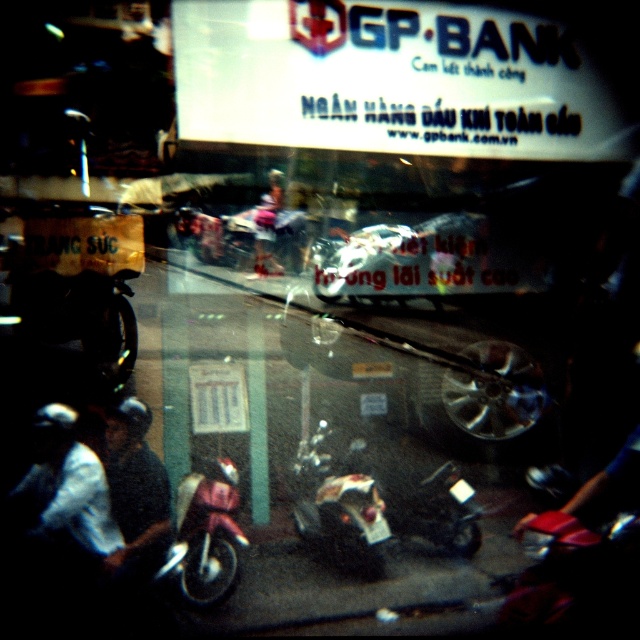
You are a delivery person needing to carry both the shiny chrome motorcycle at center and the matte pink helmet at center. Given the motorcycle is wider, will it fit in your 1.5 meter wide truck bed?

The shiny chrome motorcycle at center is wider than the matte pink helmet at center. Since the truck bed is 1.5 meters wide, you need to measure the motorcycle to confirm if it fits. The description only states the motorcycle is wider than the helmet but doesn not provide exact dimensions.

You are a delivery person who needs to place a matte pink helmet at center on the handlebars of the shiny chrome motorcycle at center. Can you do this without moving the motorcycle?

The shiny chrome motorcycle at center and matte pink helmet at center are 82.17 centimeters apart from each other. Since the helmet needs to be placed on the handlebars, which are typically within reach without moving the motorcycle, the distance might be too far. However, exact feasibility depends on the motorcycle size, but based on the given distance, it may not be possible without moving the motorcycle.

You are a delivery person who needs to load a matte pink helmet at center onto a shiny chrome motorcycle at center. Considering the size difference between them, will the helmet fit properly on the motorcycle?

The shiny chrome motorcycle at center is larger in size than the matte pink helmet at center, so the helmet should fit properly on the motorcycle as it is smaller in size.